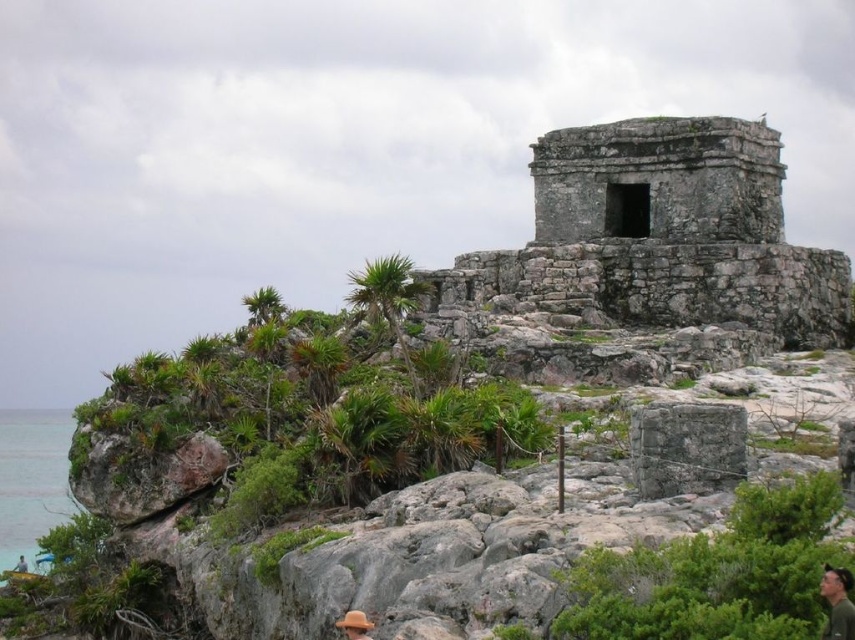
Question: Can you confirm if green leafy plants at center is positioned to the left of green fabric cap at upper right?

Choices:
 (A) no
 (B) yes

Answer: (B)

Question: Which point is farther to the camera?

Choices:
 (A) (351, 477)
 (B) (19, 476)
 (C) (366, 268)
 (D) (705, 442)

Answer: (B)

Question: From the image, what is the correct spatial relationship of clear blue water at lower left in relation to green fabric cap at upper right?

Choices:
 (A) above
 (B) below

Answer: (B)

Question: Which point appears closest to the camera in this image?

Choices:
 (A) (727, 442)
 (B) (388, 284)
 (C) (828, 634)
 (D) (211, 435)

Answer: (C)

Question: Is gray stone at center bigger than clear blue water at lower left?

Choices:
 (A) yes
 (B) no

Answer: (B)

Question: Which of these objects is positioned farthest from the gray stone at center?

Choices:
 (A) green leafy palm tree at center
 (B) green fabric cap at upper right
 (C) green leafy plants at center

Answer: (C)